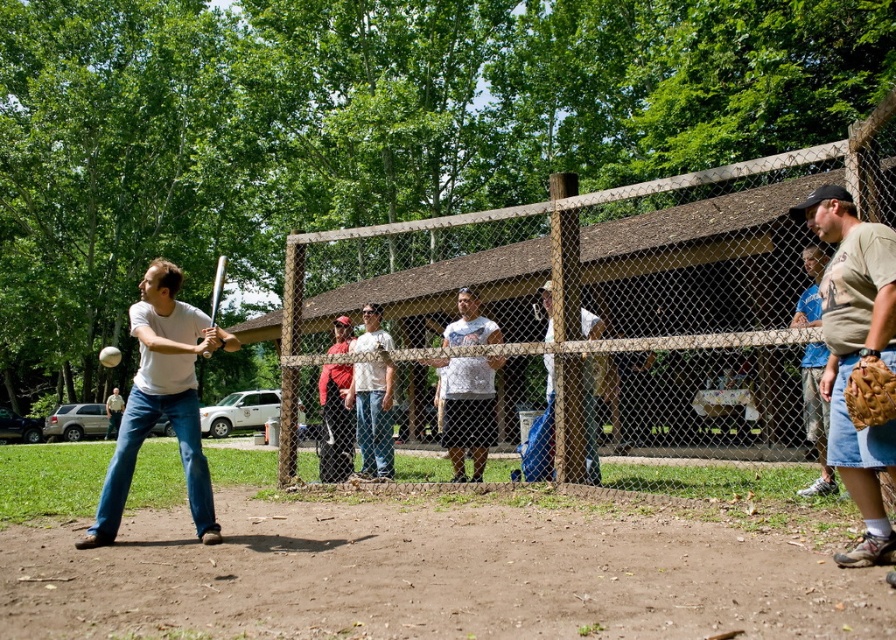
You are a spectator standing at the edge of the field. You see the wooden fence at center and the white matte baseball bat at center. Which object is closer to your right side?

The wooden fence at center is to the right of the white matte baseball bat at center, so the wooden fence at center is closer to your right side.